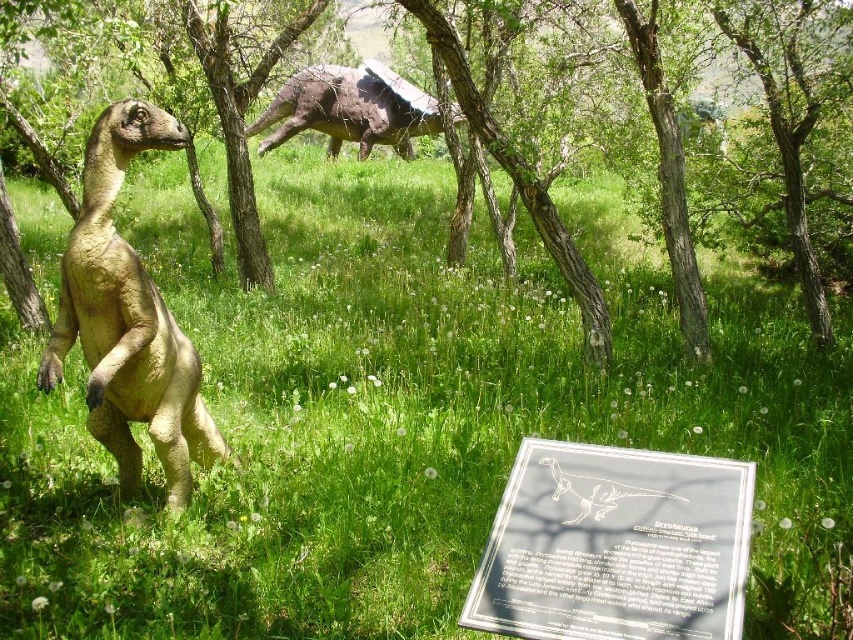
Who is lower down, transparent glass sign at center or matte brown dinosaur at left?

transparent glass sign at center is below.

The height and width of the screenshot is (640, 853). What do you see at coordinates (614, 547) in the screenshot?
I see `transparent glass sign at center` at bounding box center [614, 547].

Is point (640, 534) positioned in front of point (154, 138)?

That is True.

Locate an element on the screen. transparent glass sign at center is located at coordinates (614, 547).

Who is more distant from viewer, (611, 484) or (386, 125)?

Point (386, 125)

Is transparent glass sign at center above rustic brown dinosaur at upper center?

No.

The image size is (853, 640). In order to click on transparent glass sign at center in this screenshot , I will do [614, 547].

Can you confirm if matte brown dinosaur at left is shorter than rustic brown dinosaur at upper center?

Yes.

Is the position of matte brown dinosaur at left less distant than that of rustic brown dinosaur at upper center?

Yes, it is in front of rustic brown dinosaur at upper center.

Which is behind, point (55, 353) or point (404, 147)?

Point (404, 147)

Locate an element on the screen. matte brown dinosaur at left is located at coordinates [128, 321].